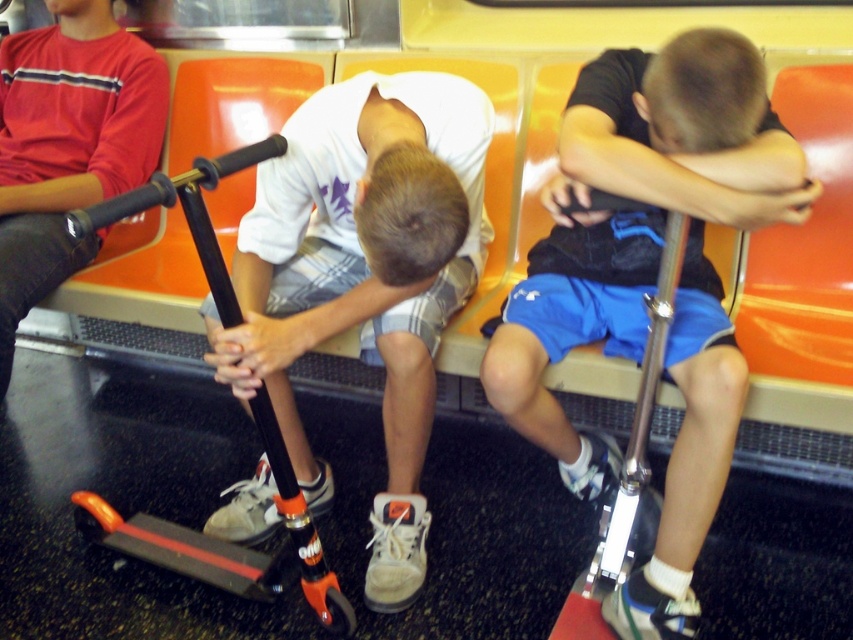
Between point (729, 396) and point (128, 52), which one is positioned behind?

Point (128, 52)

Can you confirm if matte black scooter at center is bigger than matte black scooter at lower left?

Incorrect, matte black scooter at center is not larger than matte black scooter at lower left.

Between point (759, 168) and point (99, 163), which one is positioned in front?

Point (759, 168) is in front.

Locate an element on the screen. The image size is (853, 640). matte black scooter at center is located at coordinates (648, 280).

Can you confirm if matte black scooter at center is positioned to the left of orange matte scooter at center?

In fact, matte black scooter at center is to the right of orange matte scooter at center.

Is matte black scooter at center positioned behind orange matte scooter at center?

That is True.

Does point (517, 307) come in front of point (161, 544)?

Yes, point (517, 307) is in front of point (161, 544).

What are the coordinates of `matte black scooter at center` in the screenshot? It's located at (648, 280).

You are a GUI agent. You are given a task and a screenshot of the screen. Output one action in this format:
    pyautogui.click(x=<x>, y=<y>)
    Task: Click on the matte black scooter at center
    The height and width of the screenshot is (640, 853).
    Given the screenshot: What is the action you would take?
    pyautogui.click(x=648, y=280)

Where is `matte black scooter at center`? This screenshot has height=640, width=853. matte black scooter at center is located at coordinates (648, 280).